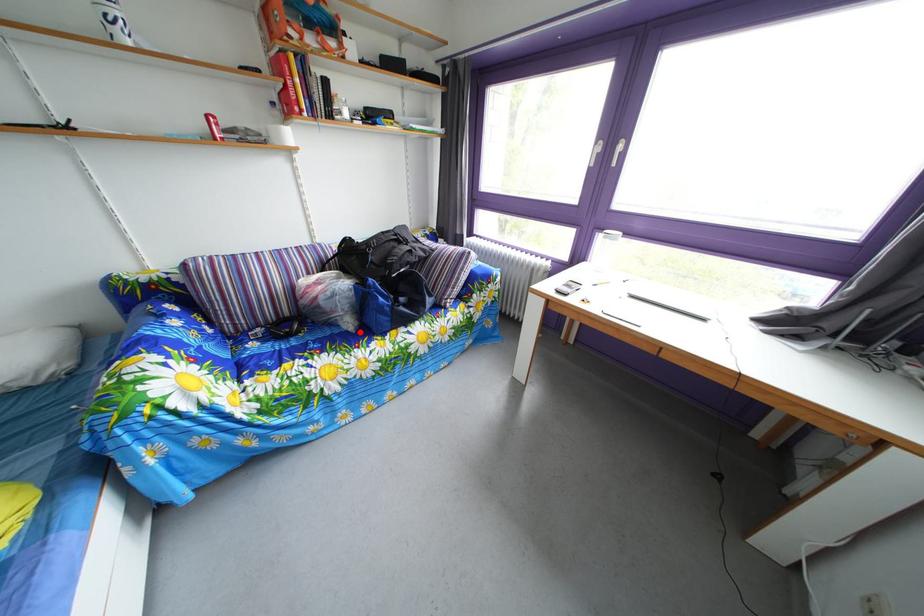
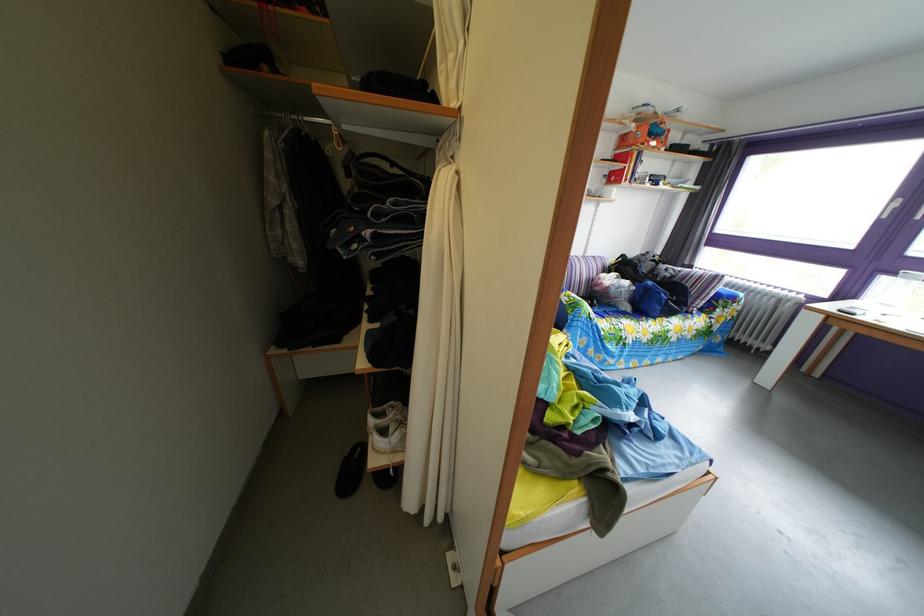
Locate, in the second image, the point that corresponds to the highlighted location in the first image.

(638, 315)